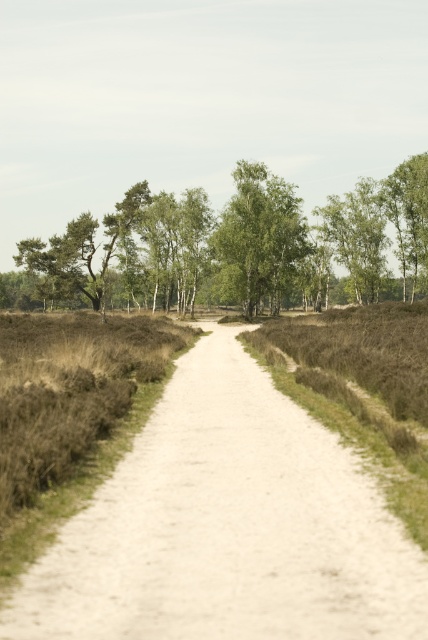
Who is more distant from viewer, (276,483) or (160,241)?

Point (160,241)

At what (x,y) coordinates should I click in order to perform the action: click on white gravel path at center. Please return your answer as a coordinate pair (x, y). This screenshot has width=428, height=640. Looking at the image, I should click on click(228, 528).

Does green leafy tree at upper center appear on the right side of green leafy tree at center?

No, green leafy tree at upper center is not to the right of green leafy tree at center.

The height and width of the screenshot is (640, 428). Describe the element at coordinates (234, 248) in the screenshot. I see `green leafy tree at upper center` at that location.

I want to click on green leafy tree at upper center, so click(x=234, y=248).

Can you confirm if white gravel path at center is positioned below green leafy tree at center?

Correct, white gravel path at center is located below green leafy tree at center.

In the scene shown: Is white gravel path at center shorter than green leafy tree at center?

Yes.

At what (x,y) coordinates should I click in order to perform the action: click on white gravel path at center. Please return your answer as a coordinate pair (x, y). This screenshot has height=640, width=428. Looking at the image, I should click on (228, 528).